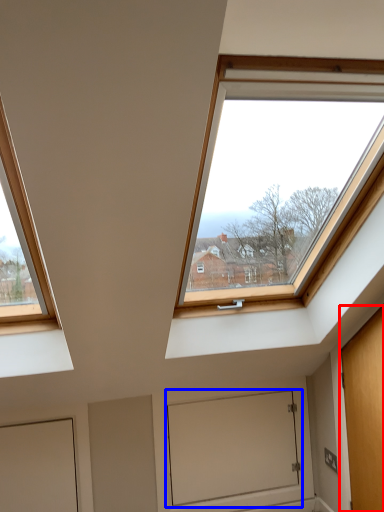
Question: Which of the following is the farthest to the observer, door (highlighted by a red box) or window screen (highlighted by a blue box)?

Choices:
 (A) door
 (B) window screen

Answer: (B)